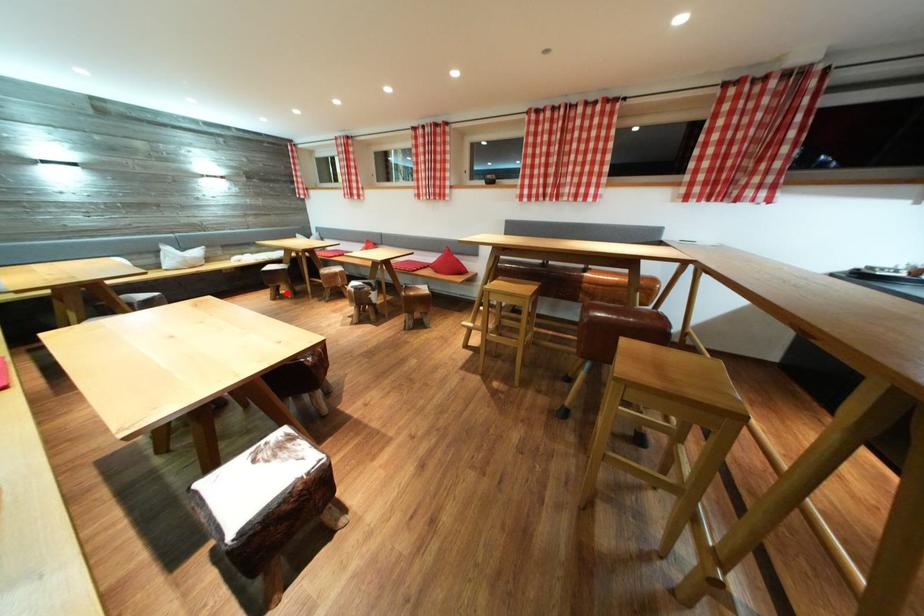
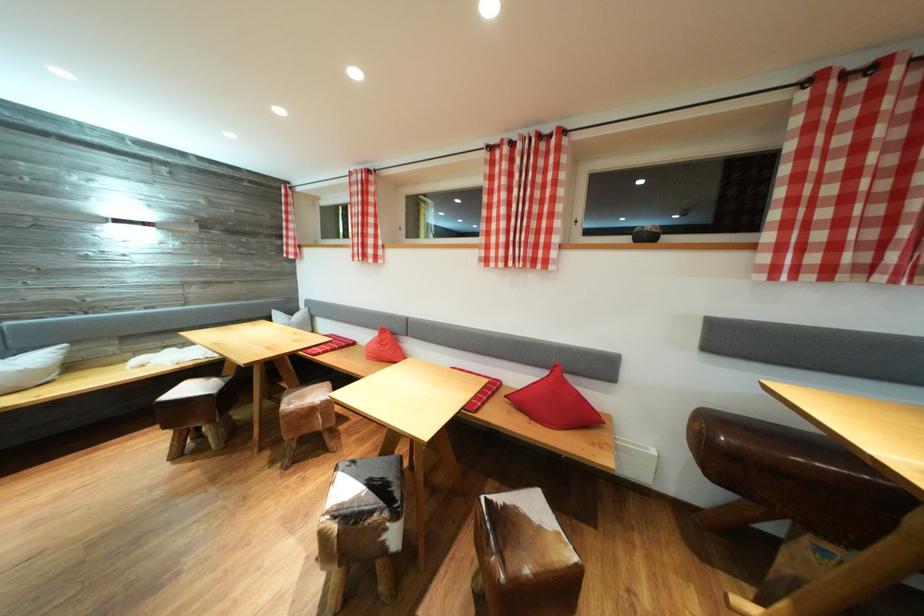
Question: I am providing you with two images of the same scene from different viewpoints. Image1 has a red point marked. In image2, the corresponding 3D location appears at what relative position? Reply with the corresponding letter.

Choices:
 (A) Closer
 (B) Farther

Answer: (B)